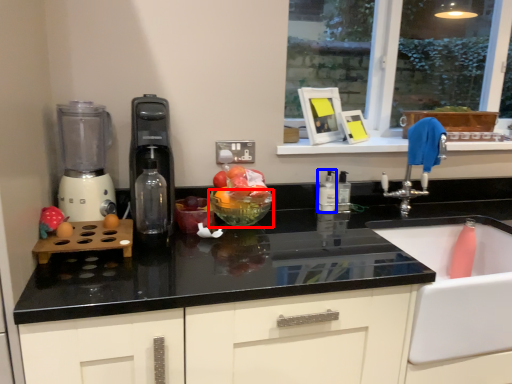
Question: Which of the following is the closest to the observer, glass bowl (highlighted by a red box) or bottle (highlighted by a blue box)?

Choices:
 (A) glass bowl
 (B) bottle

Answer: (A)